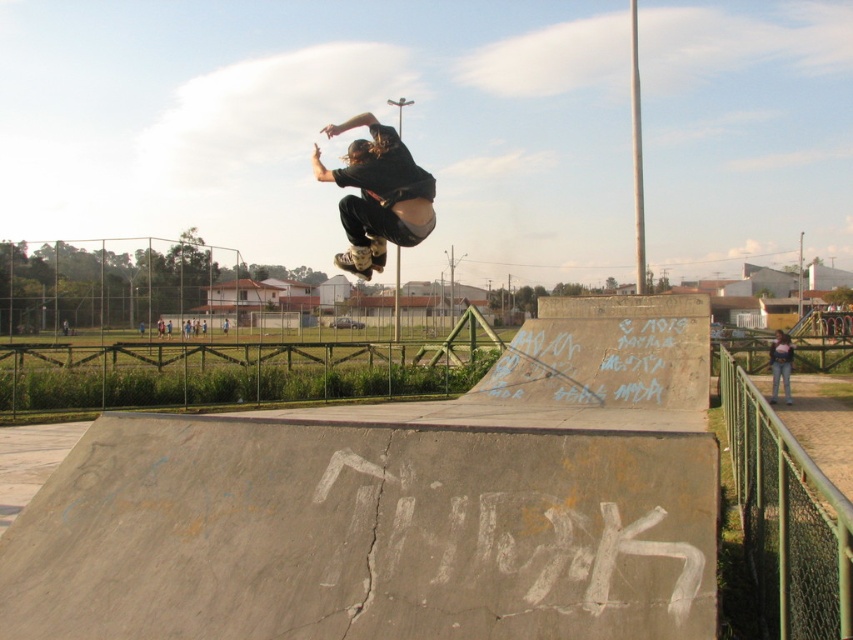
You are designing a safety net for the skatepark and need to ensure it can accommodate both the matte black skateboarder at center and the matte black skateboard at center. Based on their sizes, which one requires a wider opening in the net?

The matte black skateboarder at center requires a wider opening in the net because their width is larger than that of the matte black skateboard at center.